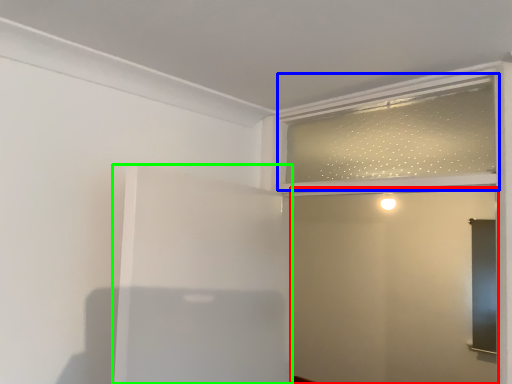
Question: Which object is positioned closest to screen door (highlighted by a red box)? Select from window frame (highlighted by a blue box) and elevator (highlighted by a green box).

Choices:
 (A) window frame
 (B) elevator

Answer: (A)